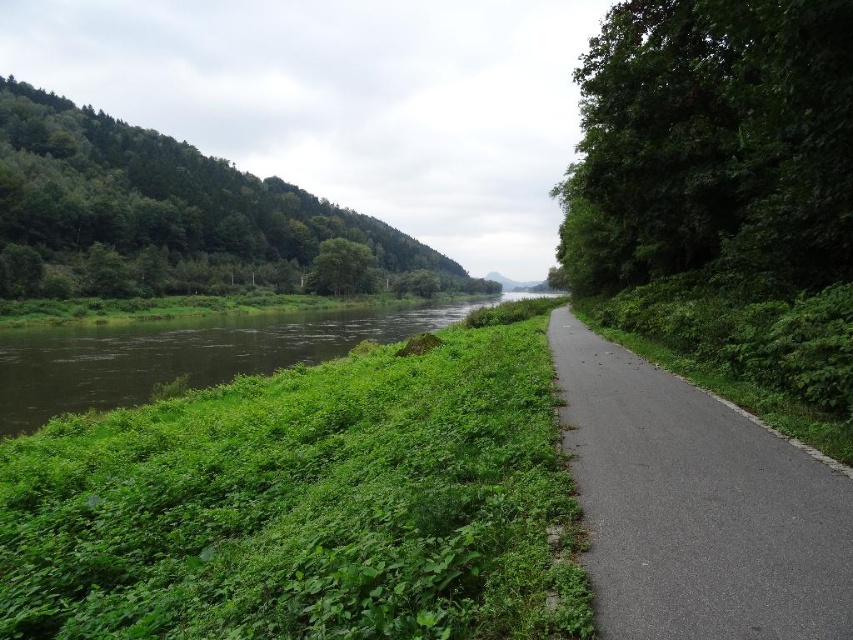
Question: Is green leafy tree at left to the right of green leafy tree at center from the viewer's perspective?

Choices:
 (A) yes
 (B) no

Answer: (B)

Question: Is the position of green grassy river at center more distant than that of green leafy tree at center?

Choices:
 (A) no
 (B) yes

Answer: (A)

Question: Which object is farther from the camera taking this photo?

Choices:
 (A) green grassy river at center
 (B) green leafy tree at center
 (C) black asphalt path at right

Answer: (B)

Question: Which point is closer to the camera taking this photo?

Choices:
 (A) (207, 209)
 (B) (485, 300)
 (C) (805, 627)
 (D) (599, 140)

Answer: (C)

Question: Is green leafy tree at right closer to camera compared to green leafy tree at left?

Choices:
 (A) yes
 (B) no

Answer: (A)

Question: Which object is the closest to the green leafy tree at center?

Choices:
 (A) black asphalt path at right
 (B) green grassy river at center
 (C) green leafy tree at right
 (D) green leafy tree at left

Answer: (D)